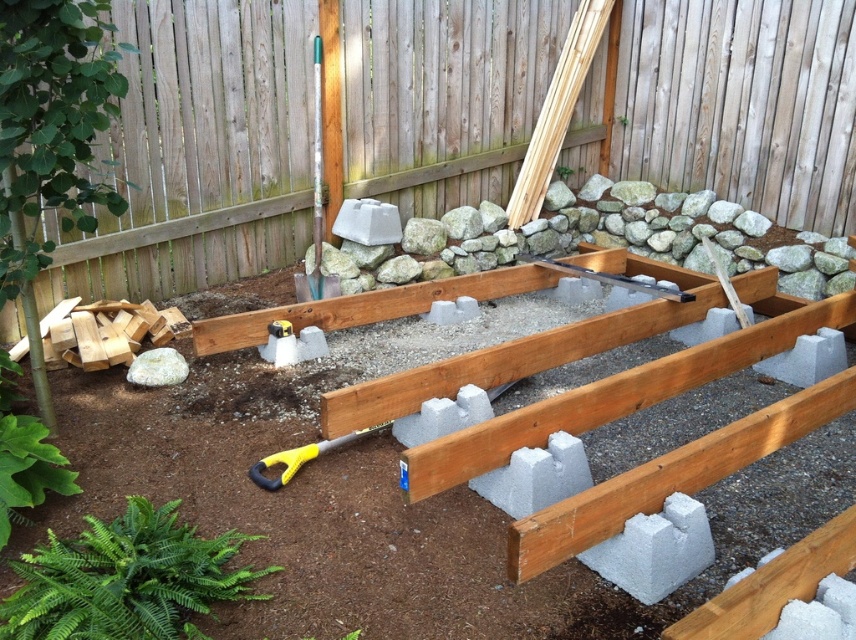
Does wooden fence at upper center have a lesser width compared to green leafy fern at lower left?

No, wooden fence at upper center is not thinner than green leafy fern at lower left.

Does point (123, 152) lie behind point (221, 589)?

Yes.

Locate an element on the screen. The image size is (856, 640). wooden fence at upper center is located at coordinates (300, 128).

Can you confirm if wooden fence at upper center is shorter than green plastic shovel at upper center?

No, wooden fence at upper center is not shorter than green plastic shovel at upper center.

Which is below, wooden fence at upper center or green plastic shovel at upper center?

green plastic shovel at upper center is below.

Is point (91, 241) farther from viewer compared to point (317, 243)?

No, it is in front of (317, 243).

The image size is (856, 640). What are the coordinates of `wooden fence at upper center` in the screenshot? It's located at (300, 128).

Can you confirm if wooden fence at upper center is taller than yellow plastic shovel at lower center?

Correct, wooden fence at upper center is much taller as yellow plastic shovel at lower center.

Can you confirm if wooden fence at upper center is wider than yellow plastic shovel at lower center?

Yes, wooden fence at upper center is wider than yellow plastic shovel at lower center.

The width and height of the screenshot is (856, 640). Describe the element at coordinates (300, 128) in the screenshot. I see `wooden fence at upper center` at that location.

The image size is (856, 640). I want to click on wooden fence at upper center, so click(x=300, y=128).